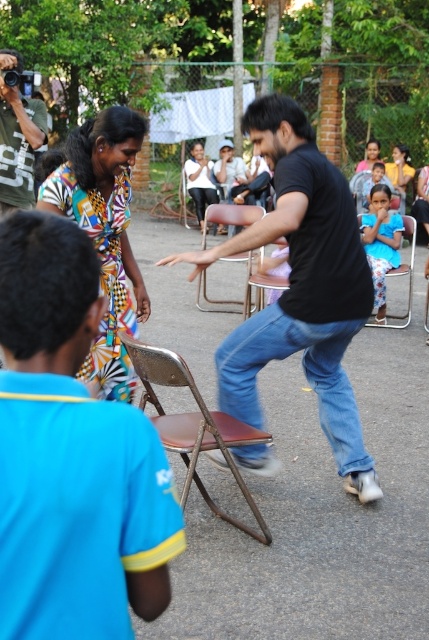
Question: Does blue fabric shirt at upper left have a larger size compared to brown leather chair at center?

Choices:
 (A) yes
 (B) no

Answer: (B)

Question: Among these objects, which one is farthest from the camera?

Choices:
 (A) black matte shirt at center
 (B) metallic brown chair at center

Answer: (B)

Question: Which of the following is the closest to the observer?

Choices:
 (A) metallic brown chair at center
 (B) black matte shirt at center
 (C) blue floral dress at center
 (D) blue fabric shirt at upper left

Answer: (D)

Question: Considering the real-world distances, which object is closest to the blue floral dress at center?

Choices:
 (A) black matte shirt at center
 (B) metallic brown chair at center
 (C) green textured shirt at upper left

Answer: (B)

Question: Does brown leather chair at center appear on the left side of blue floral dress at center?

Choices:
 (A) yes
 (B) no

Answer: (A)

Question: Is black matte shirt at center thinner than blue floral dress at center?

Choices:
 (A) no
 (B) yes

Answer: (A)